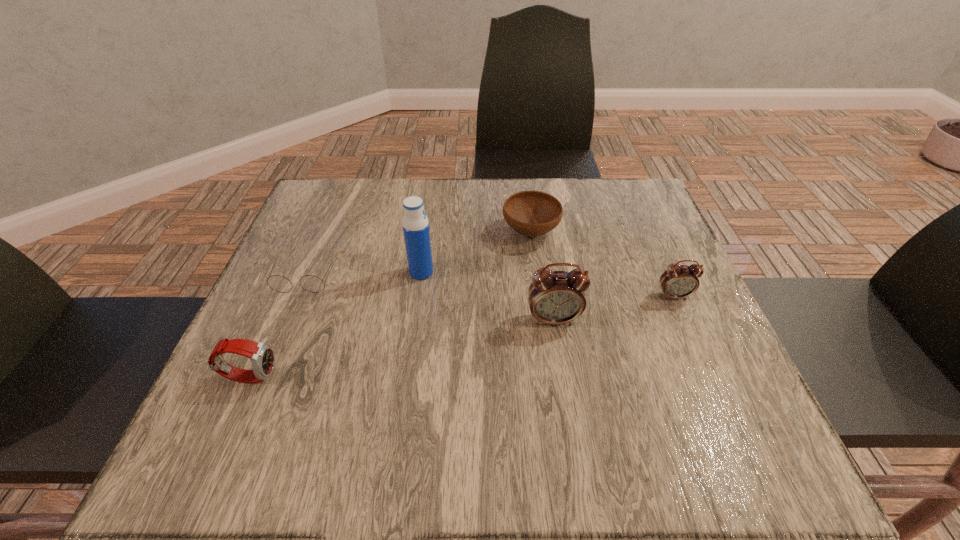
Locate an element on the screen. The image size is (960, 540). vacant place for an extra alarm clock on the left is located at coordinates (420, 346).